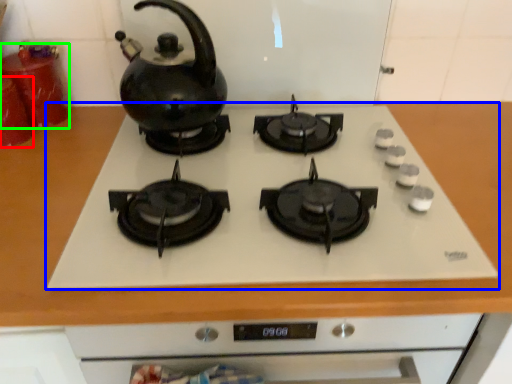
Question: Based on their relative distances, which object is farther from kitchen appliance (highlighted by a red box)? Choose from gas stove (highlighted by a blue box) and kitchen appliance (highlighted by a green box).

Choices:
 (A) gas stove
 (B) kitchen appliance

Answer: (A)